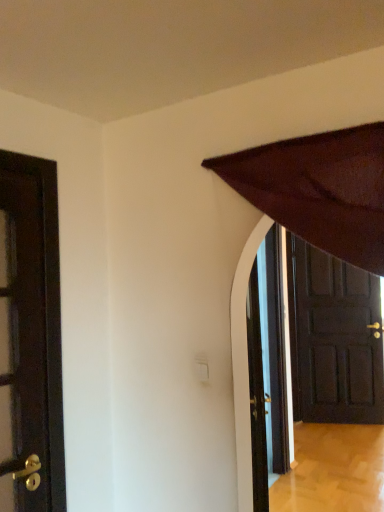
You are a GUI agent. You are given a task and a screenshot of the screen. Output one action in this format:
    pyautogui.click(x=<x>, y=<y>)
    Task: Click on the dark wood door at right, placed as the second door when sorted from left to right
    
    Given the screenshot: What is the action you would take?
    pyautogui.click(x=334, y=339)

Describe the element at coordinates (334, 339) in the screenshot. The width and height of the screenshot is (384, 512). I see `dark wood door at right, placed as the second door when sorted from left to right` at that location.

What is the approximate height of dark wood door at right, which is the 1th door from back to front?

dark wood door at right, which is the 1th door from back to front, is 1.98 meters in height.

From the picture: Measure the distance between dark brown wooden door at left, which appears as the 1th door when viewed from the left, and camera.

dark brown wooden door at left, which appears as the 1th door when viewed from the left, is 1.44 meters away from camera.

How much space does dark brown wooden door at left, positioned as the second door in back-to-front order, occupy horizontally?

dark brown wooden door at left, positioned as the second door in back-to-front order, is 1.46 inches in width.

Describe the element at coordinates (30, 338) in the screenshot. I see `dark brown wooden door at left, the first door viewed from the front` at that location.

Locate an element on the screen. The width and height of the screenshot is (384, 512). dark brown wooden door at left, positioned as the second door in back-to-front order is located at coordinates (30, 338).

The image size is (384, 512). I want to click on dark wood door at right, which is the 1th door from back to front, so click(x=334, y=339).

In the scene shown: Visually, is dark wood door at right, placed as the second door when sorted from left to right, positioned to the left or to the right of dark brown wooden door at left, which appears as the 1th door when viewed from the left?

From the image, it's evident that dark wood door at right, placed as the second door when sorted from left to right, is to the right of dark brown wooden door at left, which appears as the 1th door when viewed from the left.

Relative to dark brown wooden door at left, the first door viewed from the front, is dark wood door at right, placed as the second door when sorted from left to right, in front or behind?

Clearly, dark wood door at right, placed as the second door when sorted from left to right, is behind dark brown wooden door at left, the first door viewed from the front.

Is point (304, 266) positioned before point (32, 215)?

No, (304, 266) is further to viewer.

Based on the photo, from the image's perspective, is dark wood door at right, placed as the second door when sorted from left to right, above or below dark brown wooden door at left, the first door viewed from the front?

From the image's perspective, dark wood door at right, placed as the second door when sorted from left to right, appears below dark brown wooden door at left, the first door viewed from the front.

From a real-world perspective, is dark wood door at right, which is the 2th door in front-to-back order, physically located above or below dark brown wooden door at left, the 2th door when ordered from right to left?

From a real-world perspective, dark wood door at right, which is the 2th door in front-to-back order, is physically below dark brown wooden door at left, the 2th door when ordered from right to left.

Is dark wood door at right, which is the 1th door from back to front, wider or thinner than dark brown wooden door at left, which appears as the 1th door when viewed from the left?

Considering their sizes, dark wood door at right, which is the 1th door from back to front, looks broader than dark brown wooden door at left, which appears as the 1th door when viewed from the left.

Considering the sizes of dark wood door at right, placed as the second door when sorted from left to right, and dark brown wooden door at left, the 2th door when ordered from right to left, in the image, is dark wood door at right, placed as the second door when sorted from left to right, taller or shorter than dark brown wooden door at left, the 2th door when ordered from right to left,?

Considering their sizes, dark wood door at right, placed as the second door when sorted from left to right, has more height than dark brown wooden door at left, the 2th door when ordered from right to left.

Considering the sizes of objects dark wood door at right, which is the 2th door in front-to-back order, and dark brown wooden door at left, the first door viewed from the front, in the image provided, who is smaller, dark wood door at right, which is the 2th door in front-to-back order, or dark brown wooden door at left, the first door viewed from the front,?

dark brown wooden door at left, the first door viewed from the front, is smaller.

Can we say dark wood door at right, which is the 2th door in front-to-back order, lies outside dark brown wooden door at left, the first door viewed from the front?

Indeed, dark wood door at right, which is the 2th door in front-to-back order, is completely outside dark brown wooden door at left, the first door viewed from the front.

Is dark wood door at right, placed as the second door when sorted from left to right, positioned far away from dark brown wooden door at left, which appears as the 1th door when viewed from the left?

Yes, dark wood door at right, placed as the second door when sorted from left to right, and dark brown wooden door at left, which appears as the 1th door when viewed from the left, are quite far apart.

Could you tell me if dark wood door at right, which is the 1th door from back to front, is facing dark brown wooden door at left, the 2th door when ordered from right to left?

No, dark wood door at right, which is the 1th door from back to front, is not oriented towards dark brown wooden door at left, the 2th door when ordered from right to left.

How many degrees apart are the facing directions of dark wood door at right, which is the 1th door from back to front, and dark brown wooden door at left, the first door viewed from the front?

65 degrees separate the facing orientations of dark wood door at right, which is the 1th door from back to front, and dark brown wooden door at left, the first door viewed from the front.

Measure the distance between dark wood door at right, which is the 1th door from back to front, and dark brown wooden door at left, positioned as the second door in back-to-front order.

dark wood door at right, which is the 1th door from back to front, and dark brown wooden door at left, positioned as the second door in back-to-front order, are 3.14 meters apart.

Where is `door above the dark wood door at right, which is the 1th door from back to front (from a real-world perspective)`? This screenshot has width=384, height=512. door above the dark wood door at right, which is the 1th door from back to front (from a real-world perspective) is located at coordinates (30, 338).

Between dark brown wooden door at left, the 2th door when ordered from right to left, and dark wood door at right, the 1th door in the right-to-left sequence, which one appears on the right side from the viewer's perspective?

dark wood door at right, the 1th door in the right-to-left sequence, is more to the right.

Considering the positions of objects dark brown wooden door at left, the first door viewed from the front, and dark wood door at right, the 1th door in the right-to-left sequence, in the image provided, who is in front, dark brown wooden door at left, the first door viewed from the front, or dark wood door at right, the 1th door in the right-to-left sequence,?

dark brown wooden door at left, the first door viewed from the front, is in front.

Considering the points (44, 331) and (302, 414), which point is in front, point (44, 331) or point (302, 414)?

Positioned in front is point (44, 331).

From the image's perspective, which is below, dark brown wooden door at left, the 2th door when ordered from right to left, or dark wood door at right, which is the 2th door in front-to-back order?

dark wood door at right, which is the 2th door in front-to-back order, from the image's perspective.

From a real-world perspective, is dark brown wooden door at left, which appears as the 1th door when viewed from the left, over dark wood door at right, placed as the second door when sorted from left to right?

Yes, from a real-world perspective, dark brown wooden door at left, which appears as the 1th door when viewed from the left, is on top of dark wood door at right, placed as the second door when sorted from left to right.

Considering the sizes of objects dark brown wooden door at left, positioned as the second door in back-to-front order, and dark wood door at right, which is the 2th door in front-to-back order, in the image provided, who is wider, dark brown wooden door at left, positioned as the second door in back-to-front order, or dark wood door at right, which is the 2th door in front-to-back order,?

dark wood door at right, which is the 2th door in front-to-back order.

Considering the sizes of dark brown wooden door at left, the 2th door when ordered from right to left, and dark wood door at right, the 1th door in the right-to-left sequence, in the image, is dark brown wooden door at left, the 2th door when ordered from right to left, taller or shorter than dark wood door at right, the 1th door in the right-to-left sequence,?

Clearly, dark brown wooden door at left, the 2th door when ordered from right to left, is shorter compared to dark wood door at right, the 1th door in the right-to-left sequence.

Does dark brown wooden door at left, positioned as the second door in back-to-front order, have a larger size compared to dark wood door at right, which is the 2th door in front-to-back order?

No, dark brown wooden door at left, positioned as the second door in back-to-front order, is not bigger than dark wood door at right, which is the 2th door in front-to-back order.

Would you say dark brown wooden door at left, positioned as the second door in back-to-front order, is inside or outside dark wood door at right, which is the 1th door from back to front?

dark brown wooden door at left, positioned as the second door in back-to-front order, exists outside the volume of dark wood door at right, which is the 1th door from back to front.

Is dark brown wooden door at left, which appears as the 1th door when viewed from the left, not near dark wood door at right, which is the 2th door in front-to-back order?

dark brown wooden door at left, which appears as the 1th door when viewed from the left, is positioned a significant distance from dark wood door at right, which is the 2th door in front-to-back order.

Is dark brown wooden door at left, which appears as the 1th door when viewed from the left, looking in the opposite direction of dark wood door at right, the 1th door in the right-to-left sequence?

No, dark wood door at right, the 1th door in the right-to-left sequence, is not at the back of dark brown wooden door at left, which appears as the 1th door when viewed from the left.

Can you tell me how much dark brown wooden door at left, positioned as the second door in back-to-front order, and dark wood door at right, placed as the second door when sorted from left to right, differ in facing direction?

They differ by 65 degrees in their facing directions.

Based on the photo, could you measure the distance between dark brown wooden door at left, the first door viewed from the front, and dark wood door at right, which is the 1th door from back to front?

dark brown wooden door at left, the first door viewed from the front, is 10.29 feet away from dark wood door at right, which is the 1th door from back to front.

Find the location of a particular element. door above the dark wood door at right, the 1th door in the right-to-left sequence (from the image's perspective) is located at coordinates (30, 338).

Find the location of a particular element. The height and width of the screenshot is (512, 384). door below the dark brown wooden door at left, the 2th door when ordered from right to left (from a real-world perspective) is located at coordinates click(x=334, y=339).

The image size is (384, 512). Find the location of `door behind the dark brown wooden door at left, the 2th door when ordered from right to left`. door behind the dark brown wooden door at left, the 2th door when ordered from right to left is located at coordinates (334, 339).